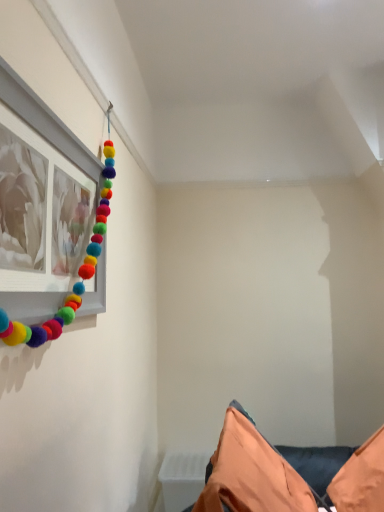
The width and height of the screenshot is (384, 512). Describe the element at coordinates (49, 219) in the screenshot. I see `matte white picture frame at upper left` at that location.

This screenshot has height=512, width=384. I want to click on matte white picture frame at upper left, so click(49, 219).

Find the location of `matte white picture frame at upper left`. matte white picture frame at upper left is located at coordinates (49, 219).